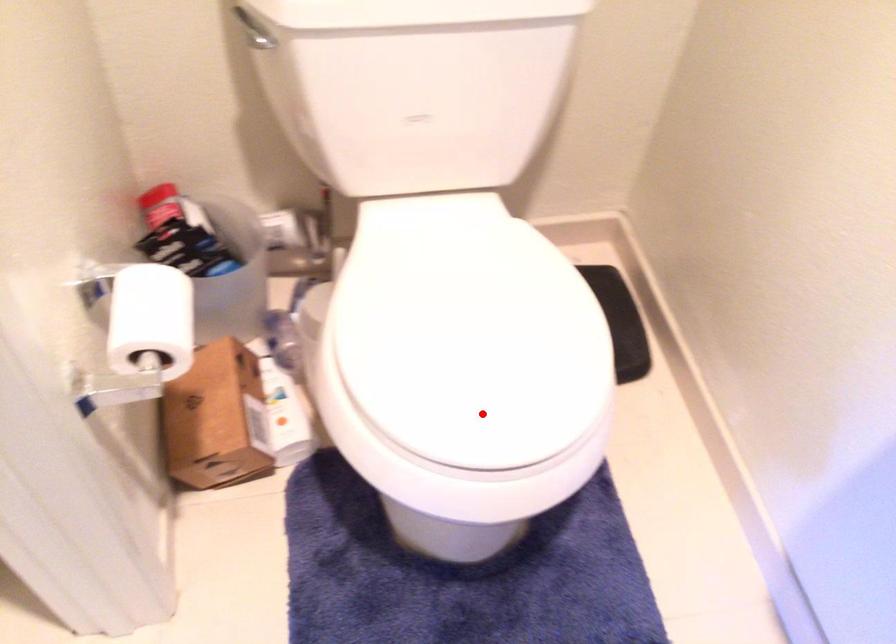
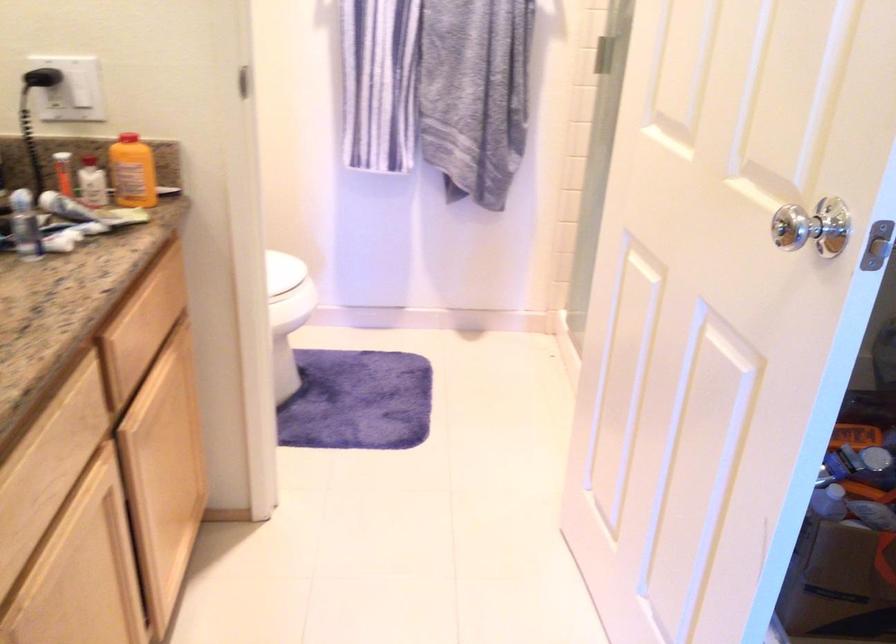
Question: I am providing you with two images of the same scene from different viewpoints. Image1 has a red point marked. In image2, the corresponding 3D location appears at what relative position? Reply with the corresponding letter.

Choices:
 (A) Closer
 (B) Farther

Answer: (B)